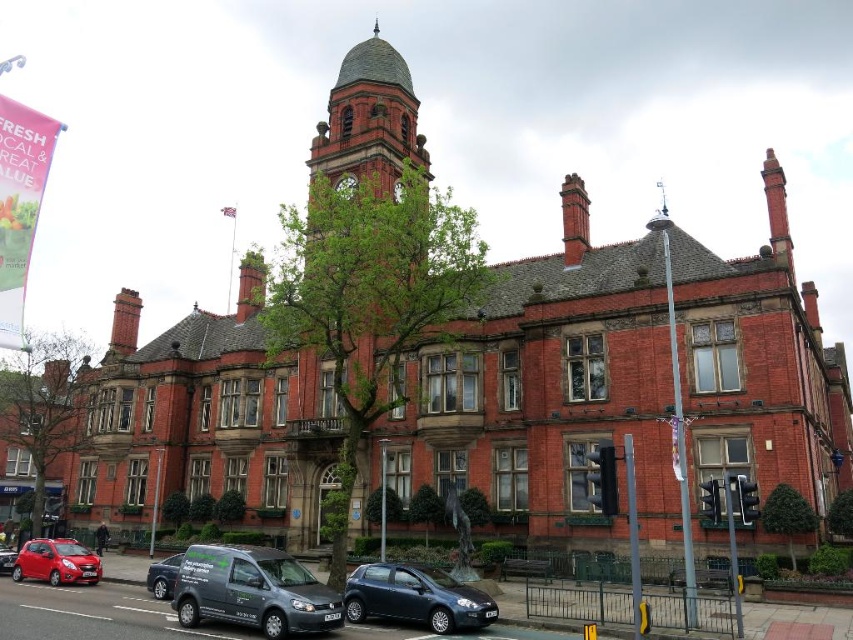
You are standing at a distance from the historic building and want to reach the point marked as point [376,102]. If you can walk at a speed of 1.5 meters per second, how many seconds will it take you to reach that point?

The distance between you and point [376,102] is 82.41 meters. At a speed of 1.5 meters per second, it will take approximately 54.94 seconds to reach the point.

You are a photographer trying to capture the historic building without any obstructions. You notice two cars parked at the lower left corner of your frame. Which car, the shiny red car at lower left or the matte red car at lower left, is blocking the view of the building more?

The shiny red car at lower left is above the matte red car at lower left, so the shiny red car at lower left is blocking the view of the building more because it is positioned higher up and closer to the building in the frame.